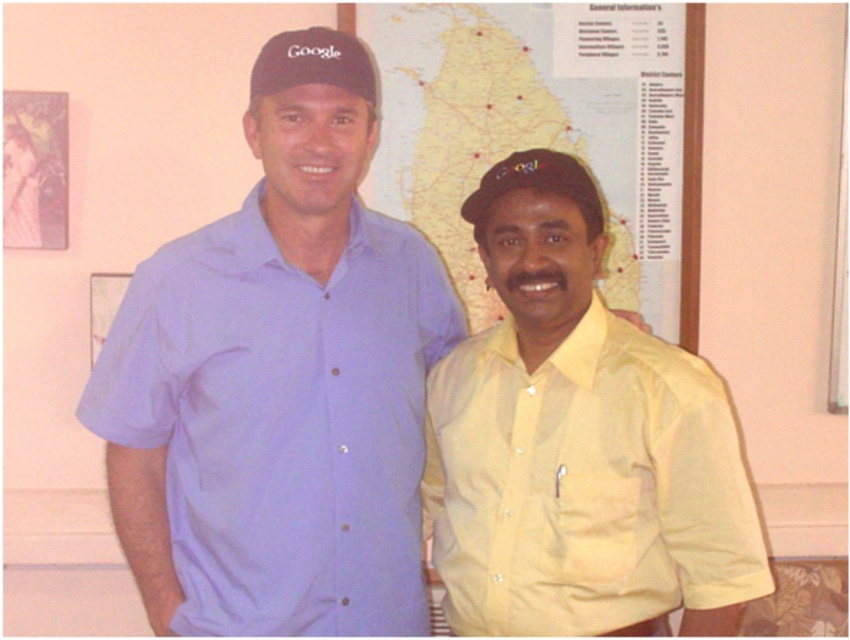
Question: Based on their relative distances, which object is farther from the map at center?

Choices:
 (A) matte blue shirt at center
 (B) yellow satin shirt at right
 (C) matte black cap at center
 (D) black matte baseball cap at upper center

Answer: (D)

Question: Does matte blue shirt at center lie behind map at center?

Choices:
 (A) no
 (B) yes

Answer: (A)

Question: Which object is positioned closest to the matte black cap at center?

Choices:
 (A) matte blue shirt at center
 (B) yellow satin shirt at right
 (C) map at center

Answer: (B)

Question: Can you confirm if matte blue shirt at center is positioned above map at center?

Choices:
 (A) yes
 (B) no

Answer: (B)

Question: Among these objects, which one is nearest to the camera?

Choices:
 (A) matte black cap at center
 (B) yellow satin shirt at right
 (C) matte blue shirt at center

Answer: (B)

Question: Is black matte baseball cap at upper center to the right of matte black cap at center from the viewer's perspective?

Choices:
 (A) no
 (B) yes

Answer: (A)